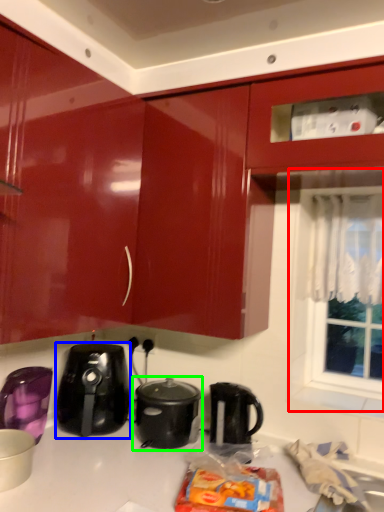
Question: Which is farther away from window (highlighted by a red box)? home appliance (highlighted by a blue box) or slow cooker (highlighted by a green box)?

Choices:
 (A) home appliance
 (B) slow cooker

Answer: (A)